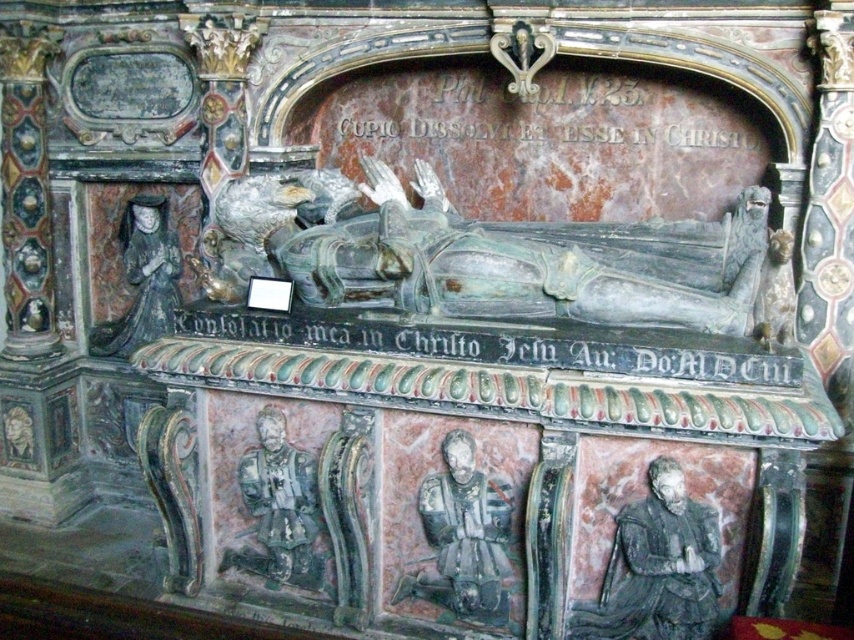
Does green patinated stone figure at center appear over bronze armor at lower left?

Yes, green patinated stone figure at center is above bronze armor at lower left.

Between green patinated stone figure at center and bronze armor at lower left, which one is positioned higher?

Positioned higher is green patinated stone figure at center.

This screenshot has width=854, height=640. I want to click on green patinated stone figure at center, so click(x=484, y=256).

The width and height of the screenshot is (854, 640). What are the coordinates of `green patinated stone figure at center` in the screenshot? It's located at (484, 256).

Is gray stone figure at center bigger than bronze armor at lower left?

Incorrect, gray stone figure at center is not larger than bronze armor at lower left.

Is gray stone figure at center further to the viewer compared to bronze armor at lower left?

No, it is in front of bronze armor at lower left.

Between point (428, 536) and point (237, 477), which one is positioned behind?

Point (237, 477)

Locate an element on the screen. gray stone figure at center is located at coordinates (463, 540).

Between gray stone figure at lower right and gray stone figure at center, which one has less height?

With less height is gray stone figure at lower right.

What are the coordinates of `gray stone figure at lower right` in the screenshot? It's located at pyautogui.click(x=657, y=566).